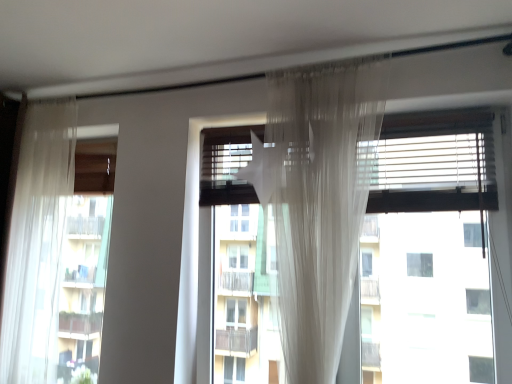
Question: Do you think sheer white curtain at left is within transparent fabric at center, or outside of it?

Choices:
 (A) outside
 (B) inside

Answer: (A)

Question: Is sheer white curtain at left in front of or behind transparent fabric at center in the image?

Choices:
 (A) front
 (B) behind

Answer: (B)

Question: In the image, is sheer white curtain at left on the left side or the right side of transparent fabric at center?

Choices:
 (A) right
 (B) left

Answer: (B)

Question: From the image's perspective, relative to sheer white curtain at left, is transparent fabric at center above or below?

Choices:
 (A) below
 (B) above

Answer: (B)

Question: Looking at their shapes, would you say transparent fabric at center is wider or thinner than sheer white curtain at left?

Choices:
 (A) thin
 (B) wide

Answer: (A)

Question: Is transparent fabric at center taller or shorter than sheer white curtain at left?

Choices:
 (A) short
 (B) tall

Answer: (A)

Question: Is point (410, 233) positioned closer to the camera than point (57, 137)?

Choices:
 (A) farther
 (B) closer

Answer: (B)